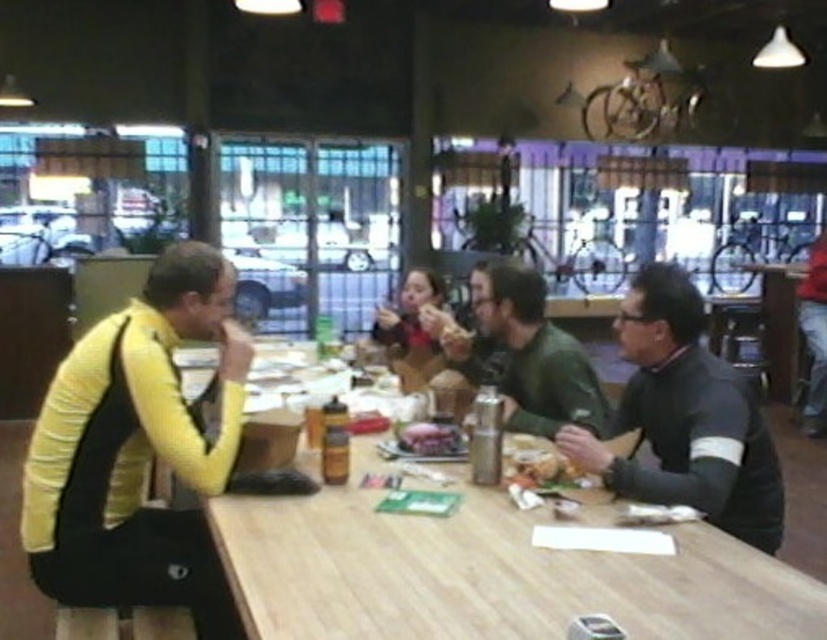
Question: Which object appears closest to the camera in this image?

Choices:
 (A) yellow sweater at left
 (B) dark gray sweater at right

Answer: (B)

Question: Which object appears farthest from the camera in this image?

Choices:
 (A) matte black jacket at center
 (B) shiny metallic can at center
 (C) dark gray sweater at right
 (D) wooden table at center

Answer: (A)

Question: Where is dark gray sweater at right located in relation to shiny golden bread at center in the image?

Choices:
 (A) right
 (B) left

Answer: (A)

Question: Is yellow sweater at left bigger than shiny metallic can at center?

Choices:
 (A) no
 (B) yes

Answer: (B)

Question: Is yellow sweater at left above dark gray sweater at right?

Choices:
 (A) yes
 (B) no

Answer: (B)

Question: Which is farther from the green matte jacket at center?

Choices:
 (A) yellow sweater at left
 (B) shiny metallic can at center

Answer: (A)